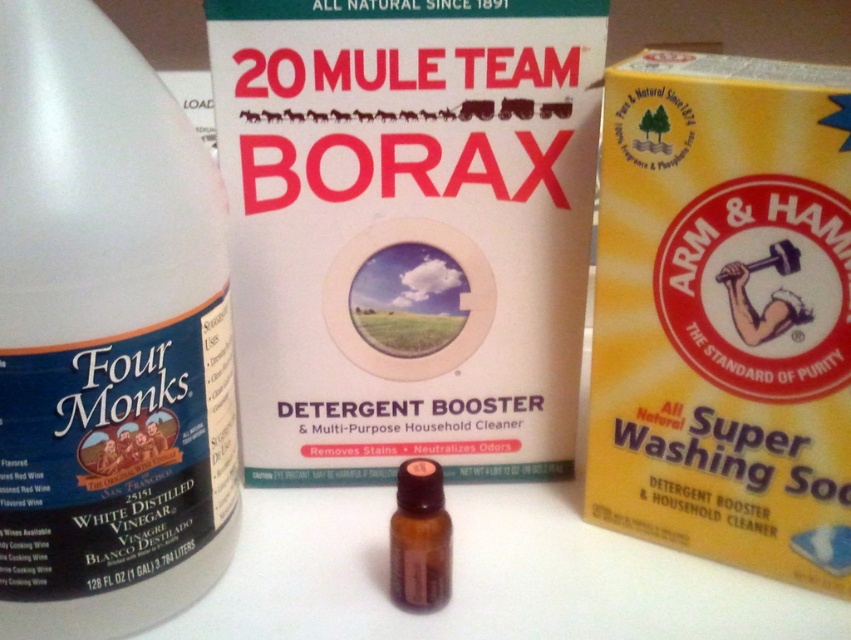
Question: Based on their relative distances, which object is farther from the white matte box at center?

Choices:
 (A) white matte bottle at left
 (B) brown glass bottle at center
 (C) yellow cardboard box at center

Answer: (B)

Question: Among these objects, which one is nearest to the camera?

Choices:
 (A) brown glass bottle at center
 (B) yellow cardboard box at center
 (C) white matte box at center
 (D) white matte bottle at left

Answer: (D)

Question: Which object appears farthest from the camera in this image?

Choices:
 (A) white matte bottle at left
 (B) brown glass bottle at center

Answer: (B)

Question: Observing the image, what is the correct spatial positioning of white matte bottle at left in reference to brown glass bottle at center?

Choices:
 (A) right
 (B) left

Answer: (B)

Question: Considering the relative positions of yellow cardboard box at center and brown glass bottle at center in the image provided, where is yellow cardboard box at center located with respect to brown glass bottle at center?

Choices:
 (A) above
 (B) below

Answer: (A)

Question: Is the position of white matte bottle at left more distant than that of brown glass bottle at center?

Choices:
 (A) yes
 (B) no

Answer: (B)